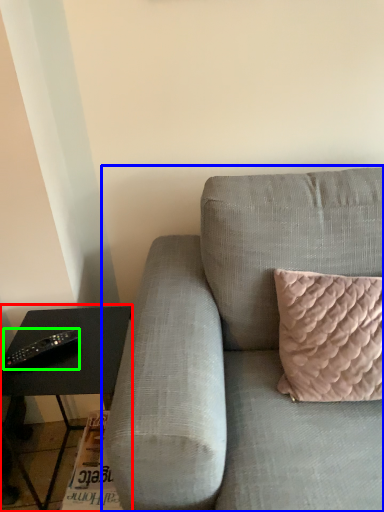
Question: Estimate the real-world distances between objects in this image. Which object is farther from table (highlighted by a red box), studio couch (highlighted by a blue box) or remote (highlighted by a green box)?

Choices:
 (A) studio couch
 (B) remote

Answer: (A)